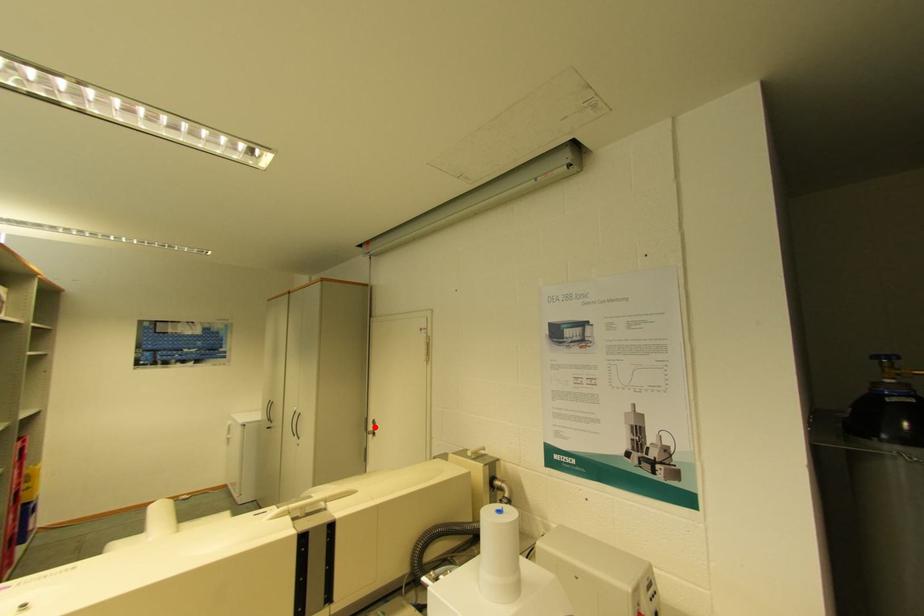
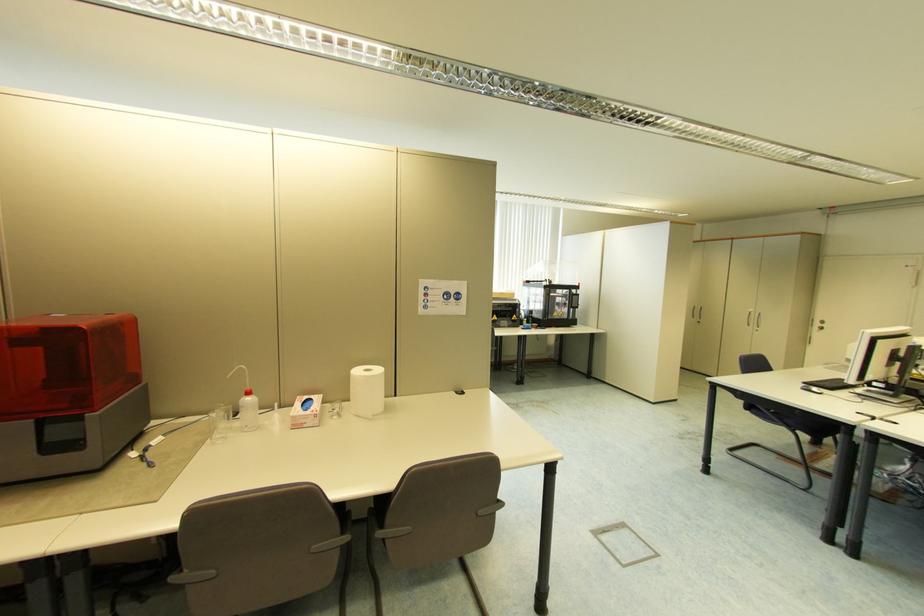
In the second image, find the point that corresponds to the highlighted location in the first image.

(821, 325)